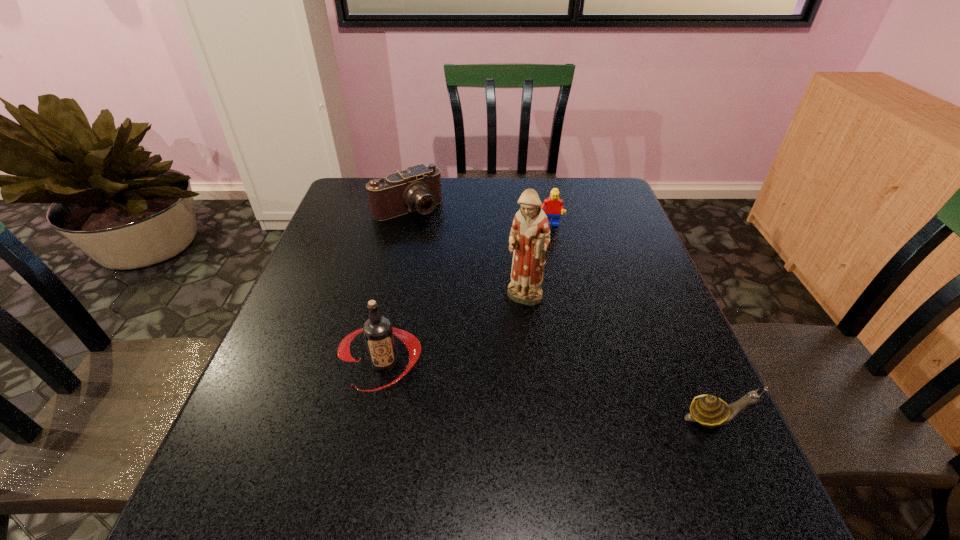
Identify the location of vacant space that satisfies the following two spatial constraints: 1. on the label of the snail; 2. on the face of the second tallest object. This screenshot has width=960, height=540. (373, 418).

Locate an element on the screen. The image size is (960, 540). free space that satisfies the following two spatial constraints: 1. on the label of the fourth farthest object; 2. on the face of the nearest object is located at coordinates [373, 418].

Identify the location of blank space that satisfies the following two spatial constraints: 1. on the front side of the camera; 2. on the face of the snail. The height and width of the screenshot is (540, 960). (359, 418).

I want to click on free spot that satisfies the following two spatial constraints: 1. on the front side of the snail; 2. on the face of the camera, so click(359, 418).

Locate an element on the screen. Image resolution: width=960 pixels, height=540 pixels. vacant space that satisfies the following two spatial constraints: 1. on the back side of the fourth object from left to right; 2. on the right side of the third farthest object is located at coordinates (516, 225).